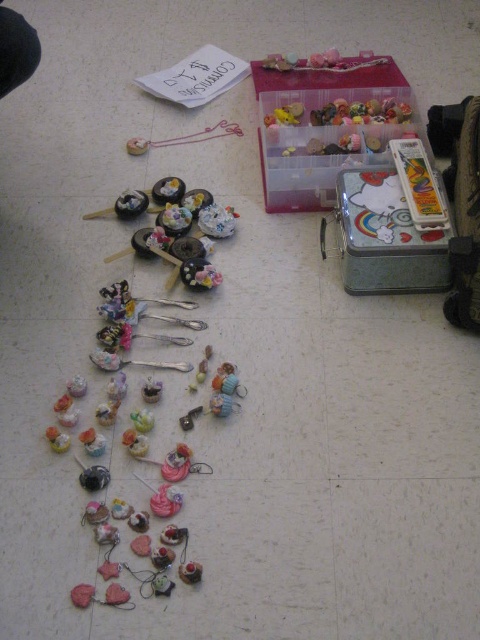
Question: Which object is the closest to the metallic silver charm at center?

Choices:
 (A) pink glossy cupcake at lower left
 (B) matte plastic cupcakes at upper center

Answer: (A)

Question: Which object is positioned closest to the pink glossy cupcake at lower left?

Choices:
 (A) matte plastic cupcakes at upper center
 (B) metallic silver charm at center

Answer: (B)

Question: Does matte plastic cupcakes at upper center appear over metallic silver charm at center?

Choices:
 (A) yes
 (B) no

Answer: (A)

Question: Does matte plastic cupcakes at upper center lie in front of metallic silver charm at center?

Choices:
 (A) no
 (B) yes

Answer: (A)

Question: Is matte plastic cupcakes at upper center in front of pink glossy cupcake at lower left?

Choices:
 (A) yes
 (B) no

Answer: (B)

Question: Which of the following is the closest to the observer?

Choices:
 (A) (157, 401)
 (B) (61, 433)

Answer: (B)